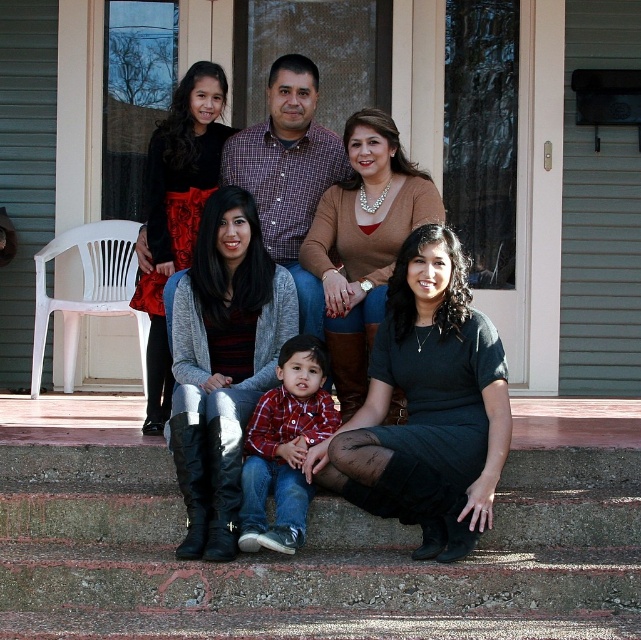
Question: Which point is closer to the camera?

Choices:
 (A) (304, 355)
 (B) (467, 340)
 (C) (499, 458)
 (D) (85, 460)

Answer: (C)

Question: Which point is closer to the camera?

Choices:
 (A) matte black boots at lower left
 (B) plaid shirt at center
 (C) black dress at lower center
 (D) concrete stairs at lower center

Answer: (D)

Question: Can you confirm if matte black boots at lower left is positioned to the right of plaid shirt at center?

Choices:
 (A) no
 (B) yes

Answer: (B)

Question: Can you confirm if matte black boots at lower left is positioned to the left of plaid shirt at center?

Choices:
 (A) yes
 (B) no

Answer: (B)

Question: Estimate the real-world distances between objects in this image. Which object is farther from the matte black boots at lower left?

Choices:
 (A) concrete stairs at lower center
 (B) plaid shirt at center
 (C) black dress at lower center

Answer: (A)

Question: Can you confirm if black dress at lower center is thinner than plaid shirt at center?

Choices:
 (A) no
 (B) yes

Answer: (A)